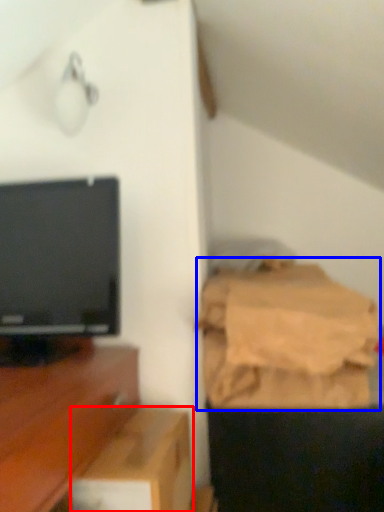
Question: Which point is further to the camera, cardboard box (highlighted by a red box) or sheet (highlighted by a blue box)?

Choices:
 (A) cardboard box
 (B) sheet

Answer: (B)